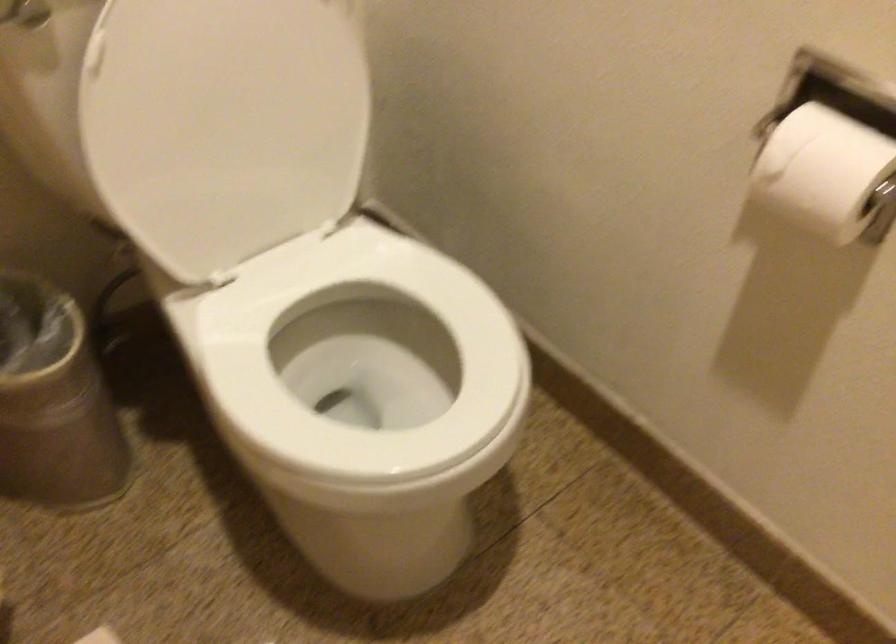
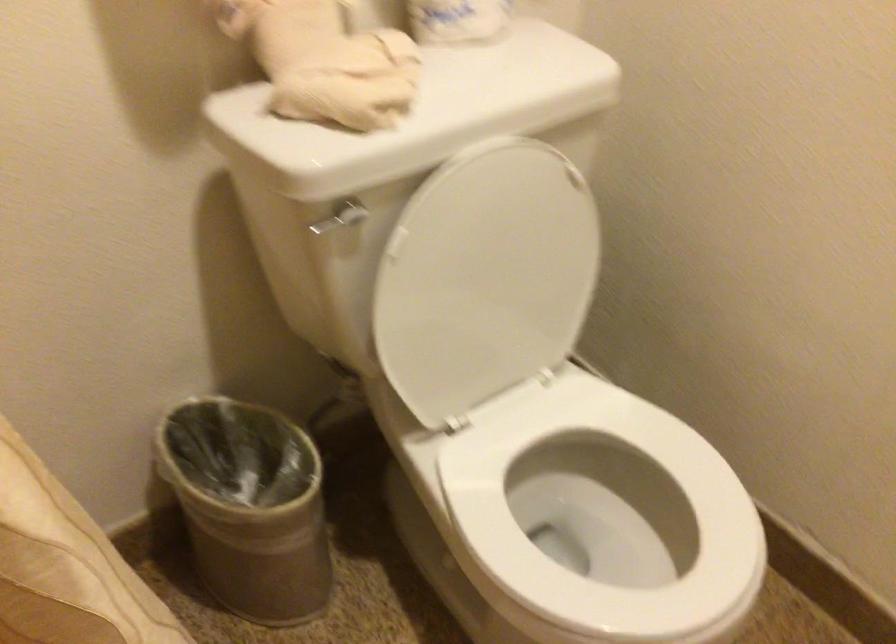
Question: The images are taken continuously from a first-person perspective. In which direction are you moving?

Choices:
 (A) Left
 (B) Right
 (C) Forward
 (D) Backward

Answer: (A)